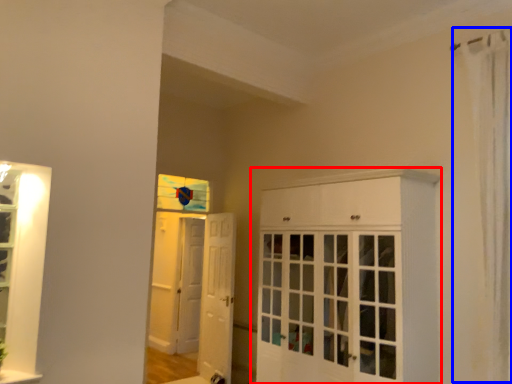
Question: Which object is further to the camera taking this photo, cabinetry (highlighted by a red box) or shower curtain (highlighted by a blue box)?

Choices:
 (A) cabinetry
 (B) shower curtain

Answer: (A)